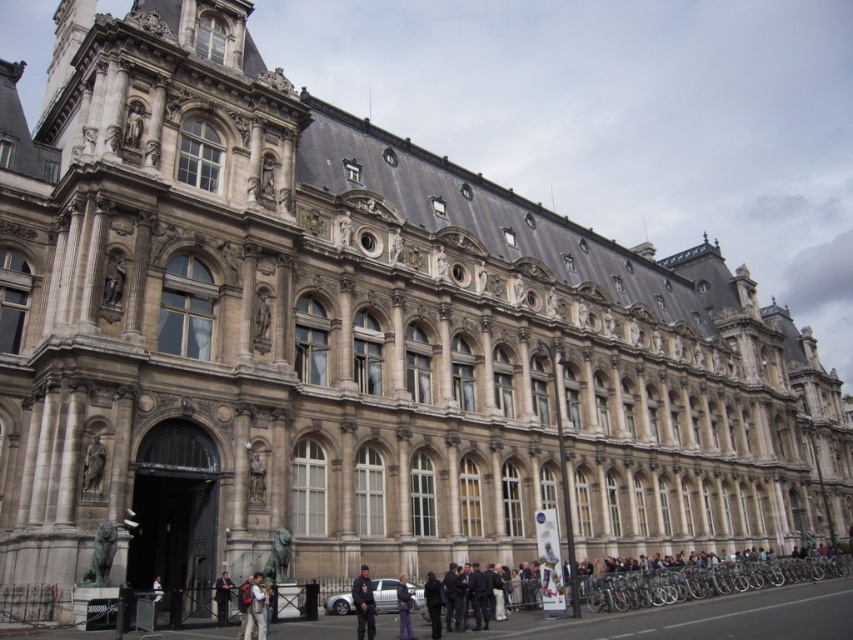
You are a photographer standing at the entrance of the historic building. You want to capture a photo that includes both the dark blue uniform at center and the polished bronze statue at lower left. What is the minimum distance you need to move backward to ensure both subjects are in frame?

The dark blue uniform at center is 16.32 meters away from the polished bronze statue at lower left. To include both in the frame, you need to move back at least 16.32 meters so that the distance between them is within your camera lens range.

You are a photographer standing in front of the historic building. You want to capture a photo that includes both the dark blue uniform at center and the polished bronze statue at lower left. Based on their positions, which object should appear higher in the photo?

The polished bronze statue at lower left appears higher in the photo because the dark blue uniform at center is positioned below it.